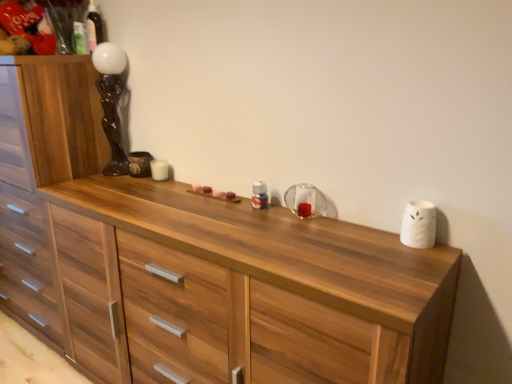
Question: From their relative heights in the image, would you say black glossy statue at upper left is taller or shorter than wooden chest of drawers at left?

Choices:
 (A) short
 (B) tall

Answer: (A)

Question: Is black glossy statue at upper left inside or outside of wooden chest of drawers at left?

Choices:
 (A) inside
 (B) outside

Answer: (B)

Question: Is black glossy statue at upper left wider or thinner than wooden chest of drawers at left?

Choices:
 (A) wide
 (B) thin

Answer: (B)

Question: From a real-world perspective, is wooden chest of drawers at left physically located above or below black glossy statue at upper left?

Choices:
 (A) below
 (B) above

Answer: (A)

Question: In the image, is wooden chest of drawers at left positioned in front of or behind black glossy statue at upper left?

Choices:
 (A) front
 (B) behind

Answer: (A)

Question: Looking at their shapes, would you say wooden chest of drawers at left is wider or thinner than black glossy statue at upper left?

Choices:
 (A) thin
 (B) wide

Answer: (B)

Question: In terms of size, does wooden chest of drawers at left appear bigger or smaller than black glossy statue at upper left?

Choices:
 (A) big
 (B) small

Answer: (A)